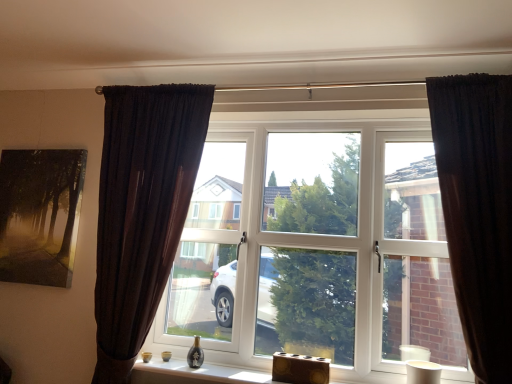
Describe the element at coordinates (40, 215) in the screenshot. I see `matte black painting at upper left` at that location.

The height and width of the screenshot is (384, 512). Describe the element at coordinates (142, 210) in the screenshot. I see `dark brown fabric curtain at left, the first curtain when ordered from left to right` at that location.

The width and height of the screenshot is (512, 384). I want to click on dark velvet curtain at right, which appears as the second curtain when viewed from the left, so click(477, 210).

Find the location of a particular element. This screenshot has width=512, height=384. wooden block at lower center is located at coordinates (300, 369).

What is the approximate width of wooden block at lower center?

It is 9.56 inches.

The width and height of the screenshot is (512, 384). What do you see at coordinates (205, 371) in the screenshot?
I see `wooden block at lower center` at bounding box center [205, 371].

Locate an element on the screen. matte black painting at upper left is located at coordinates (40, 215).

Which object is positioned more to the right, dark brown fabric curtain at left, the first curtain when ordered from left to right, or matte black painting at upper left?

Positioned to the right is dark brown fabric curtain at left, the first curtain when ordered from left to right.

Is there a large distance between dark brown fabric curtain at left, the first curtain when ordered from left to right, and matte black painting at upper left?

They are positioned close to each other.

Is dark brown fabric curtain at left, marked as the 2th curtain in a right-to-left arrangement, inside or outside of matte black painting at upper left?

dark brown fabric curtain at left, marked as the 2th curtain in a right-to-left arrangement, is outside matte black painting at upper left.

Can wooden block at lower center be found inside matte black painting at upper left?

Actually, wooden block at lower center is outside matte black painting at upper left.

How many degrees apart are the facing directions of matte black painting at upper left and wooden block at lower center?

There is a 0.879-degree angle between the facing directions of matte black painting at upper left and wooden block at lower center.

From the image's perspective, is matte black painting at upper left positioned above or below wooden block at lower center?

Based on their image positions, matte black painting at upper left is located above wooden block at lower center.

Locate an element on the screen. window sill located on the right of matte black painting at upper left is located at coordinates (205, 371).

Find the location of `furniture below the dark velvet curtain at right, the 1th curtain positioned from the right (from the image's perspective)`. furniture below the dark velvet curtain at right, the 1th curtain positioned from the right (from the image's perspective) is located at coordinates (300, 369).

From a real-world perspective, is wooden block at lower center under dark velvet curtain at right, the 1th curtain positioned from the right?

Yes, from a real-world perspective, wooden block at lower center is beneath dark velvet curtain at right, the 1th curtain positioned from the right.

Do you think wooden block at lower center is within dark velvet curtain at right, which appears as the second curtain when viewed from the left, or outside of it?

wooden block at lower center is not enclosed by dark velvet curtain at right, which appears as the second curtain when viewed from the left.

From a real-world perspective, is wooden block at lower center above or below wooden block at lower center?

wooden block at lower center is below wooden block at lower center.

In terms of size, does wooden block at lower center appear bigger or smaller than wooden block at lower center?

Clearly, wooden block at lower center is larger in size than wooden block at lower center.

Is wooden block at lower center turned away from wooden block at lower center?

No.

Which is correct: wooden block at lower center is inside wooden block at lower center, or outside of it?

wooden block at lower center is not inside wooden block at lower center, it's outside.

Between dark velvet curtain at right, the 1th curtain positioned from the right, and dark brown fabric curtain at left, marked as the 2th curtain in a right-to-left arrangement, which one has larger size?

dark brown fabric curtain at left, marked as the 2th curtain in a right-to-left arrangement.

Is dark velvet curtain at right, the 1th curtain positioned from the right, far away from dark brown fabric curtain at left, marked as the 2th curtain in a right-to-left arrangement?

Yes.

From a real-world perspective, is dark velvet curtain at right, the 1th curtain positioned from the right, above or below dark brown fabric curtain at left, marked as the 2th curtain in a right-to-left arrangement?

Clearly, from a real-world perspective, dark velvet curtain at right, the 1th curtain positioned from the right, is above dark brown fabric curtain at left, marked as the 2th curtain in a right-to-left arrangement.

Can you confirm if dark velvet curtain at right, the 1th curtain positioned from the right, is shorter than dark brown fabric curtain at left, the first curtain when ordered from left to right?

Result: Yes, dark velvet curtain at right, the 1th curtain positioned from the right, is shorter than dark brown fabric curtain at left, the first curtain when ordered from left to right.

Where is `curtain on the left of wooden block at lower center`? Image resolution: width=512 pixels, height=384 pixels. curtain on the left of wooden block at lower center is located at coordinates (142, 210).

Is wooden block at lower center further to camera compared to dark brown fabric curtain at left, marked as the 2th curtain in a right-to-left arrangement?

No, the depth of wooden block at lower center is less than that of dark brown fabric curtain at left, marked as the 2th curtain in a right-to-left arrangement.

Considering the sizes of objects wooden block at lower center and dark brown fabric curtain at left, marked as the 2th curtain in a right-to-left arrangement, in the image provided, who is wider, wooden block at lower center or dark brown fabric curtain at left, marked as the 2th curtain in a right-to-left arrangement,?

wooden block at lower center.

Is wooden block at lower center positioned with its back to dark brown fabric curtain at left, the first curtain when ordered from left to right?

wooden block at lower center does not have its back to dark brown fabric curtain at left, the first curtain when ordered from left to right.

Is dark brown fabric curtain at left, the first curtain when ordered from left to right, directly adjacent to dark velvet curtain at right, the 1th curtain positioned from the right?

They are not placed beside each other.

How different are the orientations of dark brown fabric curtain at left, the first curtain when ordered from left to right, and dark velvet curtain at right, which appears as the second curtain when viewed from the left, in degrees?

The facing directions of dark brown fabric curtain at left, the first curtain when ordered from left to right, and dark velvet curtain at right, which appears as the second curtain when viewed from the left, are 0.000797 degrees apart.

Considering the relative sizes of dark brown fabric curtain at left, the first curtain when ordered from left to right, and dark velvet curtain at right, the 1th curtain positioned from the right, in the image provided, is dark brown fabric curtain at left, the first curtain when ordered from left to right, smaller than dark velvet curtain at right, the 1th curtain positioned from the right,?

Incorrect, dark brown fabric curtain at left, the first curtain when ordered from left to right, is not smaller in size than dark velvet curtain at right, the 1th curtain positioned from the right.

Locate an element on the screen. The height and width of the screenshot is (384, 512). curtain located underneath the dark velvet curtain at right, which appears as the second curtain when viewed from the left (from a real-world perspective) is located at coordinates (142, 210).

Where is `curtain below the matte black painting at upper left (from a real-world perspective)`? Image resolution: width=512 pixels, height=384 pixels. curtain below the matte black painting at upper left (from a real-world perspective) is located at coordinates coord(142,210).

I want to click on picture frame that is above the wooden block at lower center (from a real-world perspective), so click(40, 215).

Estimate the real-world distances between objects in this image. Which object is further from wooden block at lower center, white plastic window at center or wooden block at lower center?

white plastic window at center.

Considering their positions, is matte black painting at upper left positioned further to white plastic window at center than wooden block at lower center?

matte black painting at upper left is positioned further to the anchor white plastic window at center.

Estimate the real-world distances between objects in this image. Which object is closer to white plastic window at center, matte black painting at upper left or wooden block at lower center?

wooden block at lower center is positioned closer to the anchor white plastic window at center.

Considering their positions, is matte black painting at upper left positioned closer to wooden block at lower center than wooden block at lower center?

A: wooden block at lower center lies closer to wooden block at lower center than the other object.

Estimate the real-world distances between objects in this image. Which object is closer to matte black painting at upper left, dark brown fabric curtain at left, marked as the 2th curtain in a right-to-left arrangement, or wooden block at lower center?

The object closer to matte black painting at upper left is dark brown fabric curtain at left, marked as the 2th curtain in a right-to-left arrangement.

Considering their positions, is wooden block at lower center positioned closer to matte black painting at upper left than wooden block at lower center?

Among the two, wooden block at lower center is located nearer to matte black painting at upper left.

Estimate the real-world distances between objects in this image. Which object is closer to wooden block at lower center, dark brown fabric curtain at left, marked as the 2th curtain in a right-to-left arrangement, or white plastic window at center?

Among the two, white plastic window at center is located nearer to wooden block at lower center.

Estimate the real-world distances between objects in this image. Which object is closer to matte black painting at upper left, white plastic window at center or wooden block at lower center?

white plastic window at center lies closer to matte black painting at upper left than the other object.

I want to click on window sill between matte black painting at upper left and dark velvet curtain at right, which appears as the second curtain when viewed from the left, in the horizontal direction, so click(x=205, y=371).

Locate an element on the screen. The image size is (512, 384). furniture between dark brown fabric curtain at left, the first curtain when ordered from left to right, and dark velvet curtain at right, the 1th curtain positioned from the right, in the horizontal direction is located at coordinates (300, 369).

Image resolution: width=512 pixels, height=384 pixels. What are the coordinates of `curtain between matte black painting at upper left and wooden block at lower center` in the screenshot? It's located at (142, 210).

Where is `window sill located between dark brown fabric curtain at left, marked as the 2th curtain in a right-to-left arrangement, and white plastic window at center in the left-right direction`? The height and width of the screenshot is (384, 512). window sill located between dark brown fabric curtain at left, marked as the 2th curtain in a right-to-left arrangement, and white plastic window at center in the left-right direction is located at coordinates (205, 371).